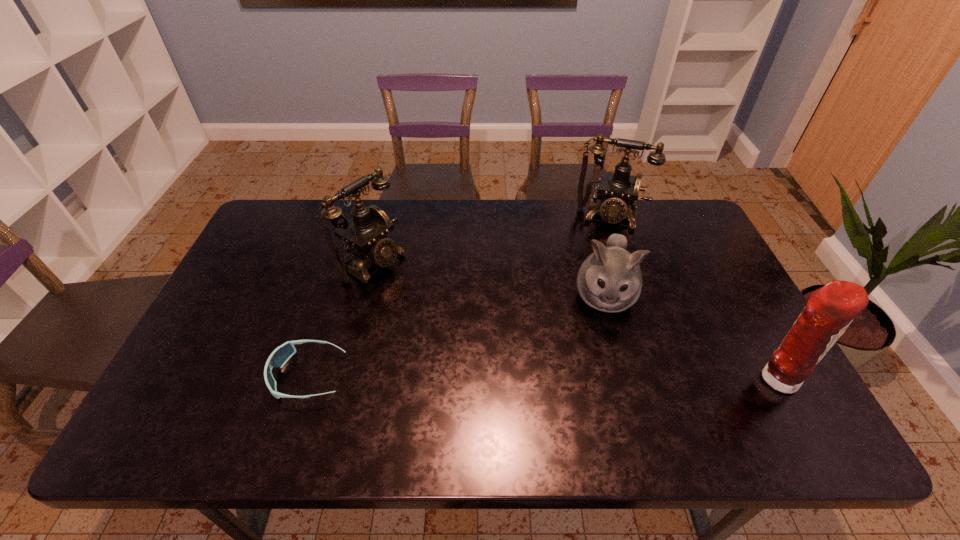
Where is `free space on the desktop that is between the shortest object and the rightmost object and is positioned on the rotary dial of the nearer telephone`? Image resolution: width=960 pixels, height=540 pixels. free space on the desktop that is between the shortest object and the rightmost object and is positioned on the rotary dial of the nearer telephone is located at coordinates (569, 377).

What are the coordinates of `free space on the desktop that is between the goggles and the condiment and is positioned on the rotary dial of the farther telephone` in the screenshot? It's located at tap(579, 377).

Identify the location of vacant spot on the desktop that is between the shortest object and the rightmost object and is positioned on the face of the fourth tallest object. This screenshot has width=960, height=540. (596, 377).